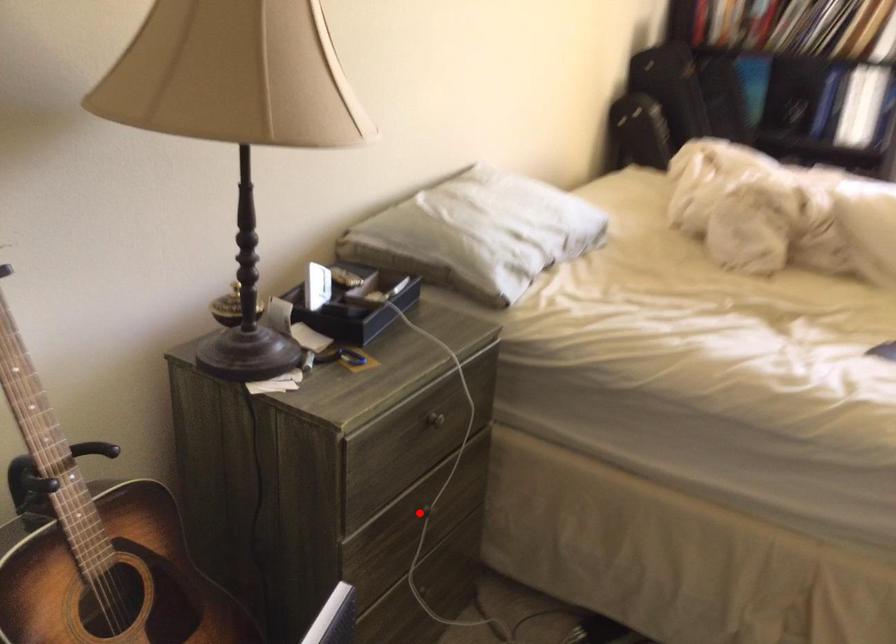
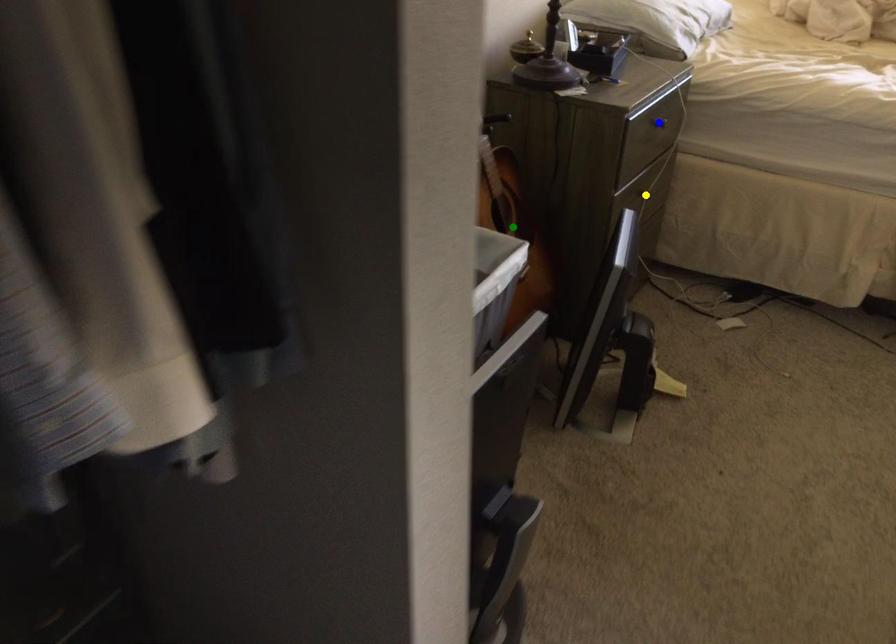
Question: I am providing you with two images of the same scene from different viewpoints. A red point is marked on the first image. You are given multiple points on the second image. In image 2, which mark is for the same physical point as the one in image 1?

Choices:
 (A) blue point
 (B) yellow point
 (C) green point

Answer: (B)